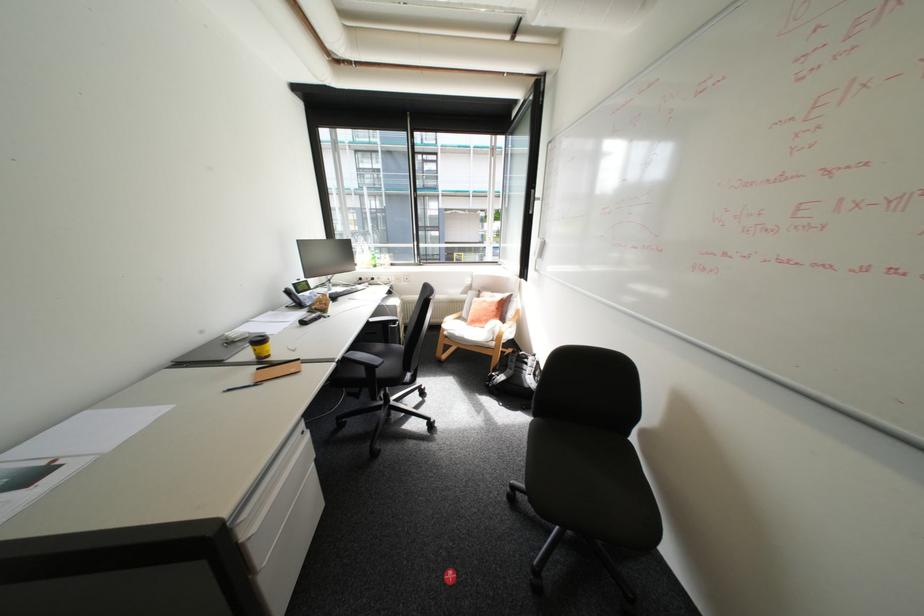
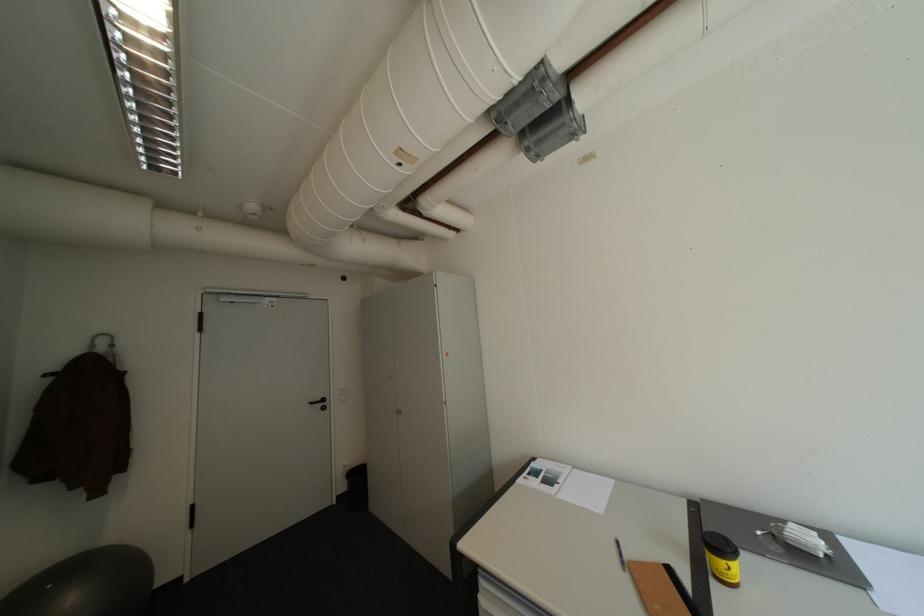
Question: I am providing you with two images of the same scene from different viewpoints. Which of the following objects are not visible in image2?

Choices:
 (A) black trash can
 (B) blue and white pen
 (C) brown folder
 (D) none of these

Answer: (D)